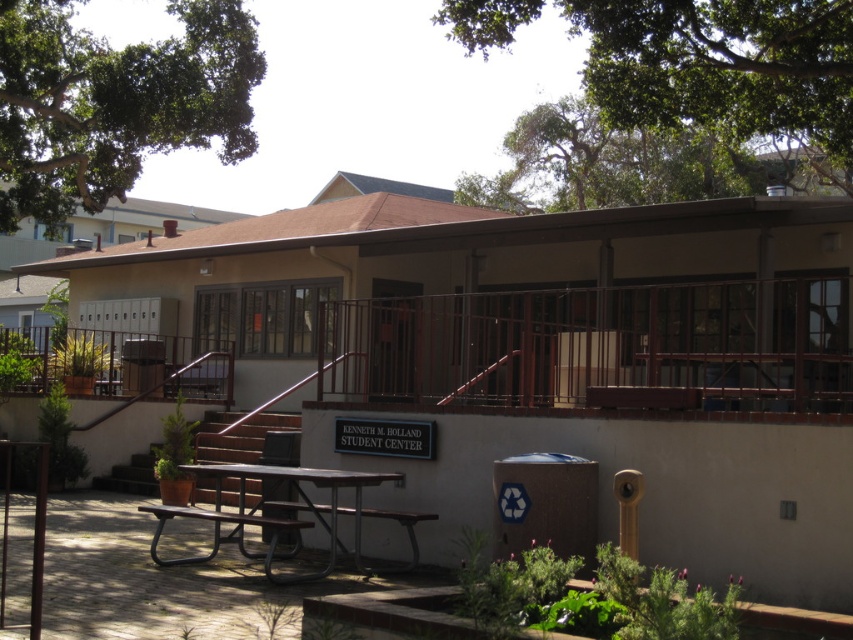
Is brown metal picnic table at center to the right of metallic picnic table at lower center from the viewer's perspective?

Correct, you'll find brown metal picnic table at center to the right of metallic picnic table at lower center.

Who is taller, brown metal picnic table at center or metallic picnic table at lower center?

brown metal picnic table at center is taller.

Does point (213, 472) lie behind point (161, 525)?

Yes, it is behind point (161, 525).

Identify the location of brown metal picnic table at center. Image resolution: width=853 pixels, height=640 pixels. (305, 497).

Does brown metal picnic table at center have a larger size compared to brown metal bench at center?

Indeed, brown metal picnic table at center has a larger size compared to brown metal bench at center.

Is brown metal picnic table at center shorter than brown metal bench at center?

In fact, brown metal picnic table at center may be taller than brown metal bench at center.

Does point (277, 579) lie in front of point (283, 509)?

Yes, it is in front of point (283, 509).

In order to click on brown metal picnic table at center in this screenshot , I will do `click(305, 497)`.

Is metallic picnic table at lower center below brown metal bench at center?

Yes.

Does metallic picnic table at lower center have a lesser width compared to brown metal bench at center?

No.

Is point (283, 554) positioned behind point (403, 522)?

Yes.

You are a GUI agent. You are given a task and a screenshot of the screen. Output one action in this format:
    pyautogui.click(x=<x>, y=<y>)
    Task: Click on the metallic picnic table at lower center
    
    Given the screenshot: What is the action you would take?
    pyautogui.click(x=223, y=538)